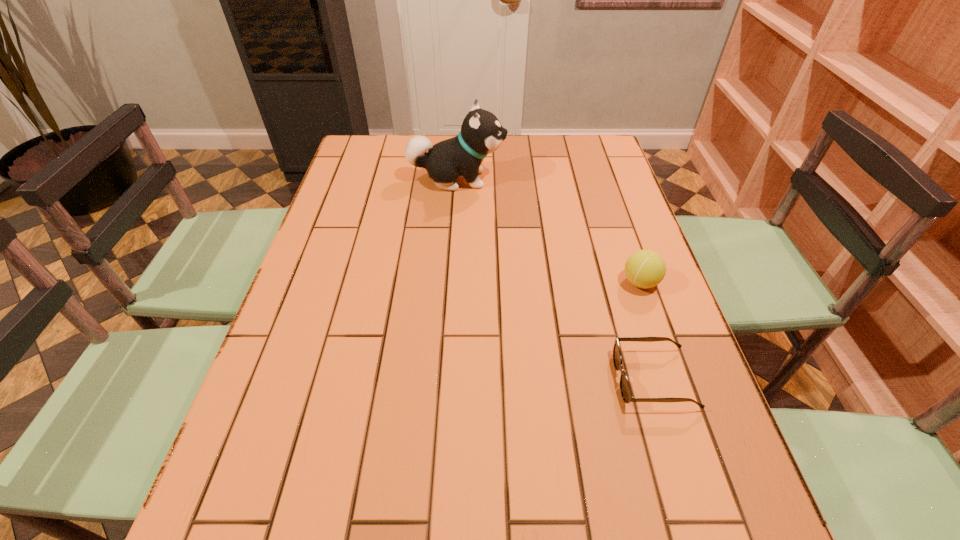
Identify the location of vacant space located 0.340m at the front lenses of the shortest object. Image resolution: width=960 pixels, height=540 pixels. (451, 379).

Locate an element on the screen. This screenshot has height=540, width=960. object present at the far edge is located at coordinates (481, 133).

Image resolution: width=960 pixels, height=540 pixels. In order to click on tennis ball present at the right edge in this screenshot , I will do `click(645, 269)`.

Where is `sunglasses at the right edge`? The width and height of the screenshot is (960, 540). sunglasses at the right edge is located at coordinates (625, 388).

In the image, there is a desktop. Where is `vacant space at the far edge`? The height and width of the screenshot is (540, 960). vacant space at the far edge is located at coordinates (555, 161).

In the image, there is a desktop. At what (x,y) coordinates should I click in order to perform the action: click on vacant space at the left edge. Please return your answer as a coordinate pair (x, y). Looking at the image, I should click on (341, 335).

In the image, there is a desktop. Where is `vacant space at the right edge`? This screenshot has height=540, width=960. vacant space at the right edge is located at coordinates (639, 423).

The height and width of the screenshot is (540, 960). Find the location of `blank space at the far right corner of the desktop`. blank space at the far right corner of the desktop is located at coordinates (588, 153).

The height and width of the screenshot is (540, 960). Identify the location of vacant space that's between the sunglasses and the second tallest object. (647, 330).

The image size is (960, 540). Find the location of `vacant point located between the leftmost object and the second shortest object`. vacant point located between the leftmost object and the second shortest object is located at coordinates (548, 231).